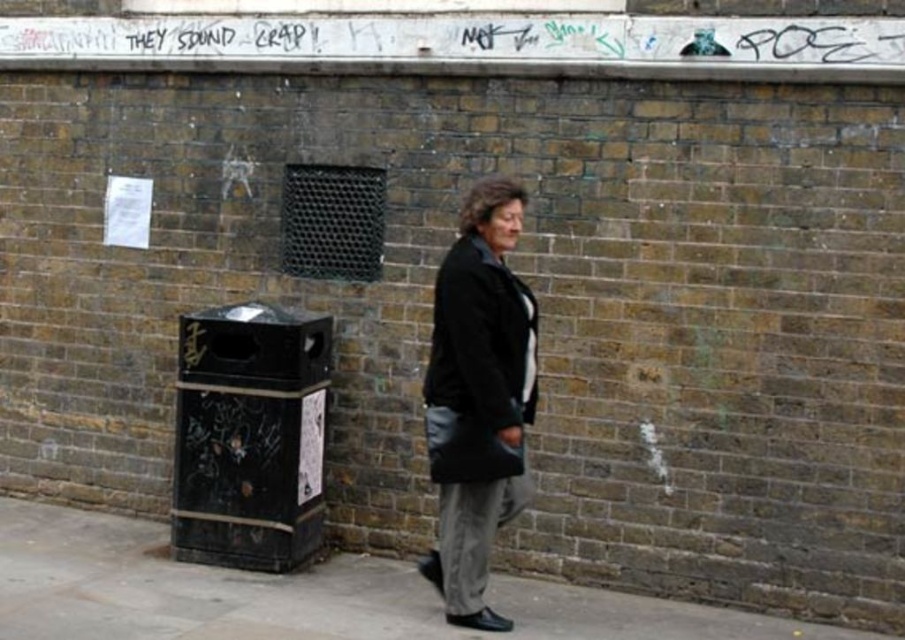
Looking at this image, you are a delivery robot that is 1.2 meters wide. You need to move from the gray concrete pavement at lower center to the black leather jacket at center. Is there enough space for you to pass through the gap between them?

The distance between the gray concrete pavement at lower center and the black leather jacket at center is 1.37 meters. Since the robot is 1.2 meters wide, there is enough space for it to pass through the gap.

You are a delivery person trying to place a package on the gray concrete pavement at lower center. However, there is a black leather jacket at center in the way. Can you place the package there without moving the jacket?

The gray concrete pavement at lower center is bigger than the black leather jacket at center, so there is enough space to place the package there without moving the jacket.